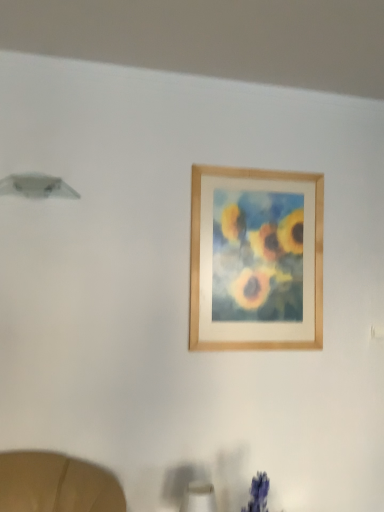
This screenshot has height=512, width=384. I want to click on white matte table lamp at lower center, so click(x=198, y=498).

Image resolution: width=384 pixels, height=512 pixels. Describe the element at coordinates (198, 498) in the screenshot. I see `white matte table lamp at lower center` at that location.

Identify the location of wooden frame at upper center. (256, 259).

What is the approximate width of wooden frame at upper center?

1.27 inches.

The image size is (384, 512). What do you see at coordinates (256, 259) in the screenshot?
I see `wooden frame at upper center` at bounding box center [256, 259].

At what (x,y) coordinates should I click in order to perform the action: click on white matte table lamp at lower center. Please return your answer as a coordinate pair (x, y). Looking at the image, I should click on 198,498.

In the scene shown: In the image, is white matte table lamp at lower center on the left side or the right side of wooden frame at upper center?

Clearly, white matte table lamp at lower center is on the left of wooden frame at upper center in the image.

Considering the positions of objects white matte table lamp at lower center and wooden frame at upper center in the image provided, who is in front, white matte table lamp at lower center or wooden frame at upper center?

white matte table lamp at lower center is closer to the camera.

Considering the positions of points (183, 496) and (205, 325), is point (183, 496) farther from camera compared to point (205, 325)?

No, (183, 496) is in front of (205, 325).

From the image's perspective, would you say white matte table lamp at lower center is positioned over wooden frame at upper center?

No, from the image's perspective, white matte table lamp at lower center is not above wooden frame at upper center.

From a real-world perspective, which object rests below the other?

In real-world perspective, white matte table lamp at lower center is lower.

Is white matte table lamp at lower center wider than wooden frame at upper center?

Correct, the width of white matte table lamp at lower center exceeds that of wooden frame at upper center.

Which of these two, white matte table lamp at lower center or wooden frame at upper center, stands taller?

Standing taller between the two is wooden frame at upper center.

In terms of size, does white matte table lamp at lower center appear bigger or smaller than wooden frame at upper center?

In the image, white matte table lamp at lower center appears to be smaller than wooden frame at upper center.

Is wooden frame at upper center inside white matte table lamp at lower center?

Actually, wooden frame at upper center is outside white matte table lamp at lower center.

Is white matte table lamp at lower center placed right next to wooden frame at upper center?

No, white matte table lamp at lower center is not beside wooden frame at upper center.

Looking at this image, is white matte table lamp at lower center aimed at wooden frame at upper center?

No.

Based on the photo, how much distance is there between white matte table lamp at lower center and wooden frame at upper center?

37.76 inches.

I want to click on picture frame located on the right of white matte table lamp at lower center, so click(x=256, y=259).

Considering the positions of objects wooden frame at upper center and white matte table lamp at lower center in the image provided, who is more to the left, wooden frame at upper center or white matte table lamp at lower center?

white matte table lamp at lower center.

Does wooden frame at upper center lie in front of white matte table lamp at lower center?

That is False.

Is point (269, 323) positioned in front of point (193, 493)?

No, (269, 323) is behind (193, 493).

From the image's perspective, is wooden frame at upper center located above white matte table lamp at lower center?

Indeed, from the image's perspective, wooden frame at upper center is shown above white matte table lamp at lower center.

Consider the image. From a real-world perspective, is wooden frame at upper center positioned above or below white matte table lamp at lower center?

Clearly, from a real-world perspective, wooden frame at upper center is above white matte table lamp at lower center.

Based on the photo, which of these two, wooden frame at upper center or white matte table lamp at lower center, is wider?

white matte table lamp at lower center.

Between wooden frame at upper center and white matte table lamp at lower center, which one has more height?

With more height is wooden frame at upper center.

Considering the sizes of objects wooden frame at upper center and white matte table lamp at lower center in the image provided, who is bigger, wooden frame at upper center or white matte table lamp at lower center?

Bigger between the two is wooden frame at upper center.

Is wooden frame at upper center inside the boundaries of white matte table lamp at lower center, or outside?

wooden frame at upper center is not inside white matte table lamp at lower center, it's outside.

Is wooden frame at upper center far from white matte table lamp at lower center?

wooden frame at upper center is actually quite close to white matte table lamp at lower center.

Is wooden frame at upper center positioned with its back to white matte table lamp at lower center?

That's not correct — wooden frame at upper center is not looking away from white matte table lamp at lower center.

How many degrees apart are the facing directions of wooden frame at upper center and white matte table lamp at lower center?

They differ by 1.68 degrees in their facing directions.

At what (x,y) coordinates should I click in order to perform the action: click on table lamp directly beneath the wooden frame at upper center (from a real-world perspective). Please return your answer as a coordinate pair (x, y). Image resolution: width=384 pixels, height=512 pixels. Looking at the image, I should click on (198, 498).

Image resolution: width=384 pixels, height=512 pixels. I want to click on picture frame lying above the white matte table lamp at lower center (from the image's perspective), so click(256, 259).

Where is `table lamp that appears on the left of wooden frame at upper center`? table lamp that appears on the left of wooden frame at upper center is located at coordinates (198, 498).